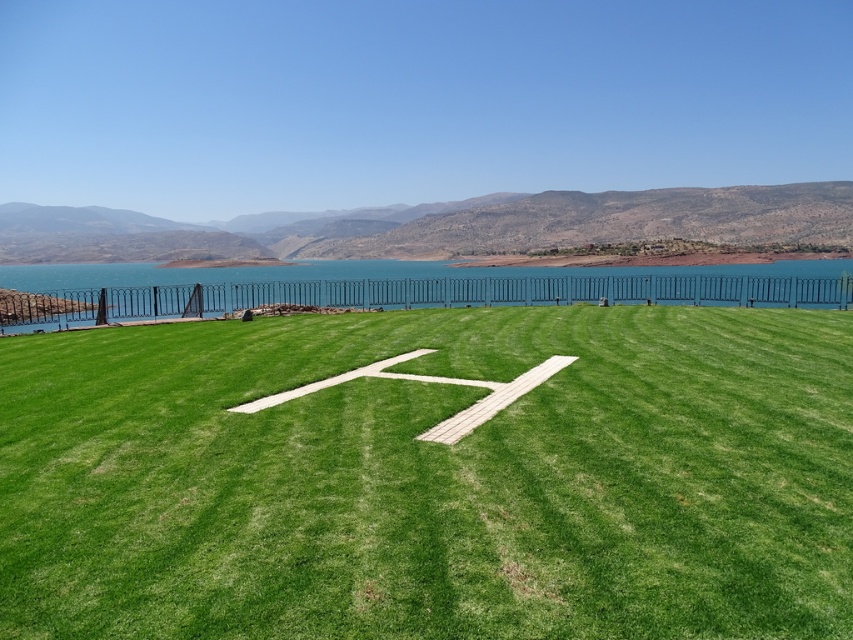
You are standing on the green grass at center and want to walk to the blue water at upper center. Which direction should you move to reach the water?

You should move to the left because the green grass at center is positioned on the right side of blue water at upper center, meaning the water is to the left of the grass.

You are standing on the green grass at center and want to reach the blue water at upper center. Which direction should you move to get there?

You should move upward because the green grass at center is located below the blue water at upper center.